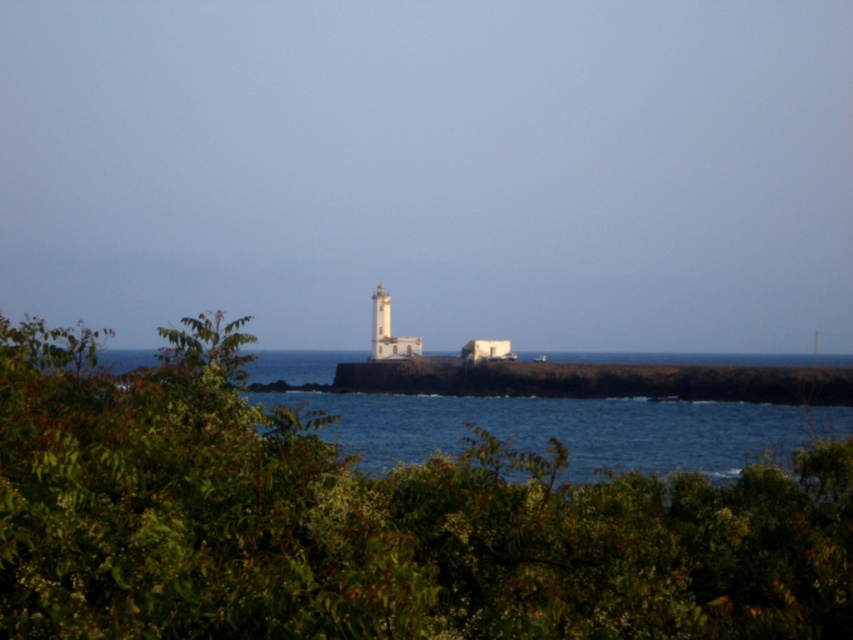
Question: Can you confirm if green leafy shrub at center is wider than white stone wall at center?

Choices:
 (A) yes
 (B) no

Answer: (B)

Question: Which point is farther from the camera taking this photo?

Choices:
 (A) (409, 348)
 (B) (727, 451)
 (C) (808, 396)

Answer: (A)

Question: Is white stone wall at center positioned in front of white concrete lighthouse at center?

Choices:
 (A) no
 (B) yes

Answer: (B)

Question: Which point is closer to the camera?

Choices:
 (A) (599, 369)
 (B) (650, 508)
 (C) (662, 435)

Answer: (B)

Question: Which object appears closest to the camera in this image?

Choices:
 (A) white painted concrete tower at center
 (B) blue water at center
 (C) white stone wall at center
 (D) white concrete lighthouse at center

Answer: (B)

Question: Is green leafy shrub at center in front of white painted concrete tower at center?

Choices:
 (A) yes
 (B) no

Answer: (A)